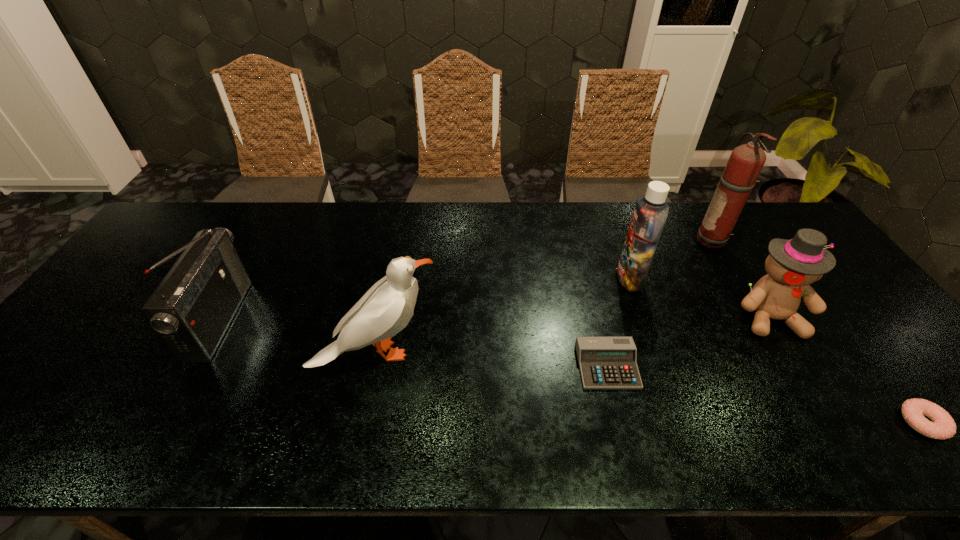
Select which object appears as the closest to the fourth object from left to right. Please provide its 2D coordinates. Your answer should be formatted as a tuple, i.e. [(x, y)], where the tuple contains the x and y coordinates of a point satisfying the conditions above.

[(605, 362)]

Locate an element on the screen. This screenshot has height=540, width=960. vacant region that satisfies the following two spatial constraints: 1. on the side of the tallest object with the label and nozzle; 2. on the front side of the calculator is located at coordinates (786, 366).

This screenshot has height=540, width=960. Find the location of `free space that satisfies the following two spatial constraints: 1. on the front-facing side of the leftmost object; 2. on the back side of the calculator`. free space that satisfies the following two spatial constraints: 1. on the front-facing side of the leftmost object; 2. on the back side of the calculator is located at coordinates (194, 366).